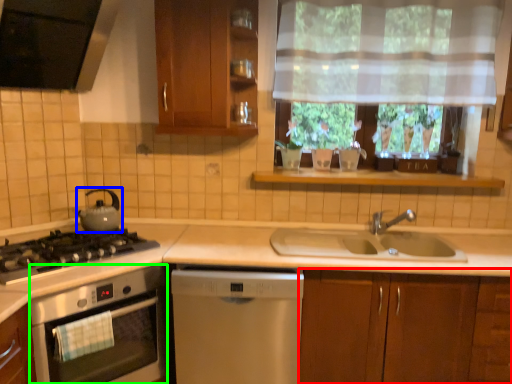
Question: Based on their relative distances, which object is nearer to cabinetry (highlighted by a red box)? Choose from kitchen appliance (highlighted by a blue box) and kitchen appliance (highlighted by a green box).

Choices:
 (A) kitchen appliance
 (B) kitchen appliance

Answer: (B)